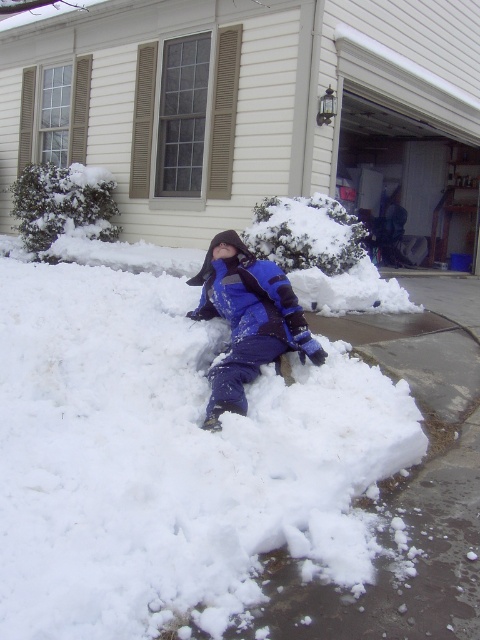
Between white fluffy snow at center and blue fleece jacket at center, which one appears on the left side from the viewer's perspective?

From the viewer's perspective, white fluffy snow at center appears more on the left side.

Which of these two, white fluffy snow at center or blue fleece jacket at center, stands taller?

Standing taller between the two is white fluffy snow at center.

Does point (52, 500) come closer to viewer compared to point (230, 364)?

That is True.

You are a GUI agent. You are given a task and a screenshot of the screen. Output one action in this format:
    pyautogui.click(x=<x>, y=<y>)
    Task: Click on the white fluffy snow at center
    
    Given the screenshot: What is the action you would take?
    pyautogui.click(x=168, y=460)